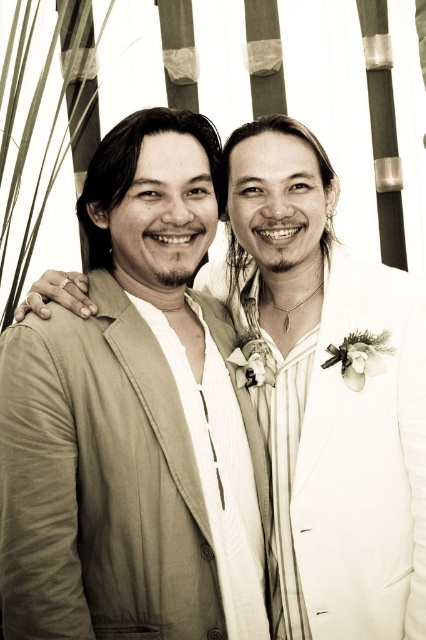
Is light beige fabric business suit at left taller than white satin suit at right?

No.

Does point (123, 436) lie behind point (359, 504)?

No, (123, 436) is in front of (359, 504).

Identify the location of light beige fabric business suit at left. point(100,484).